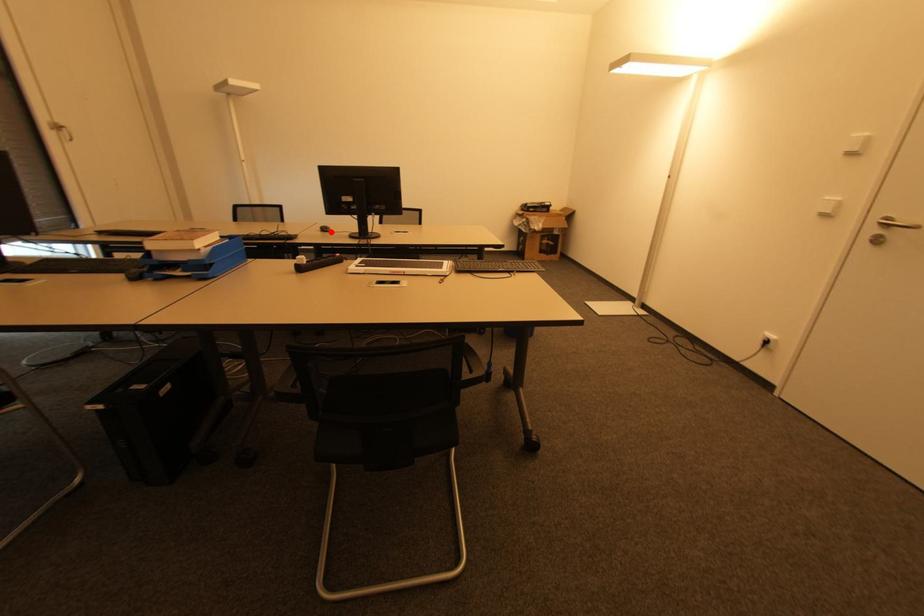
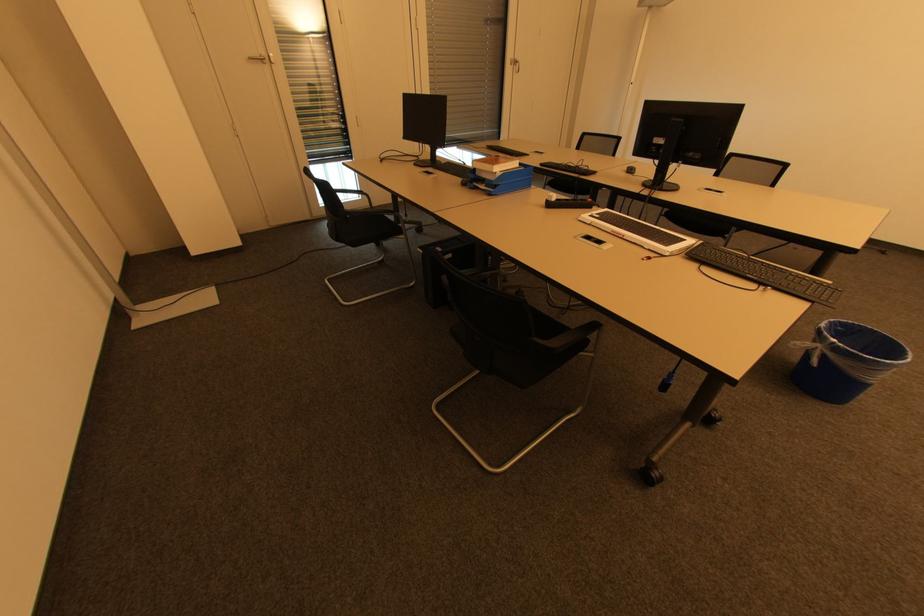
Question: I am providing you with two images of the same scene from different viewpoints. In image1, a red point is highlighted. Considering the same 3D point in image2, which of the following is correct?

Choices:
 (A) It is closer
 (B) It is farther

Answer: (A)